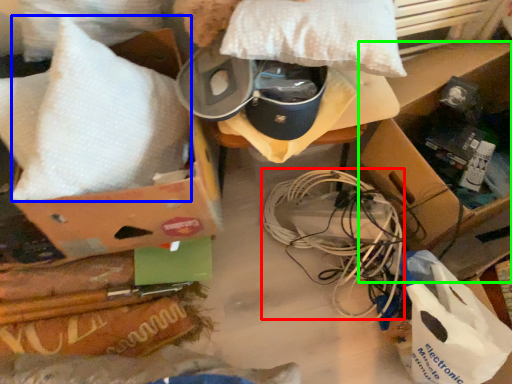
Question: Which object is positioned closest to wire (highlighted by a red box)? Select from pillow (highlighted by a blue box) and cardboard box (highlighted by a green box).

Choices:
 (A) pillow
 (B) cardboard box

Answer: (B)